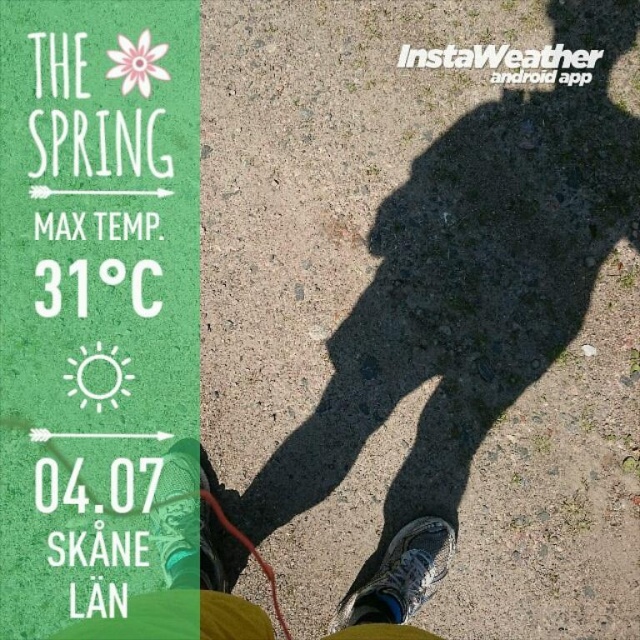
Which is above, gray fabric pants at lower center or white mesh shoe at lower center?

gray fabric pants at lower center

Does point (218, 598) come behind point (384, 580)?

No, it is in front of (384, 580).

You are a GUI agent. You are given a task and a screenshot of the screen. Output one action in this format:
    pyautogui.click(x=<x>, y=<y>)
    Task: Click on the gray fabric pants at lower center
    The width and height of the screenshot is (640, 640).
    Given the screenshot: What is the action you would take?
    pyautogui.click(x=397, y=582)

From the picture: Is white mesh shoe at lower center shorter than green fabric shoe at lower center?

Indeed, white mesh shoe at lower center has a lesser height compared to green fabric shoe at lower center.

From the picture: Can you confirm if white mesh shoe at lower center is positioned above green fabric shoe at lower center?

Actually, white mesh shoe at lower center is below green fabric shoe at lower center.

What are the coordinates of `white mesh shoe at lower center` in the screenshot? It's located at (401, 576).

Between gray fabric pants at lower center and green fabric shoe at lower center, which one is positioned lower?

gray fabric pants at lower center is below.

Between gray fabric pants at lower center and green fabric shoe at lower center, which one has more height?

Standing taller between the two is gray fabric pants at lower center.

Which is behind, point (202, 536) or point (186, 529)?

The point (202, 536) is more distant.

This screenshot has width=640, height=640. Find the location of `gray fabric pants at lower center`. gray fabric pants at lower center is located at coordinates (397, 582).